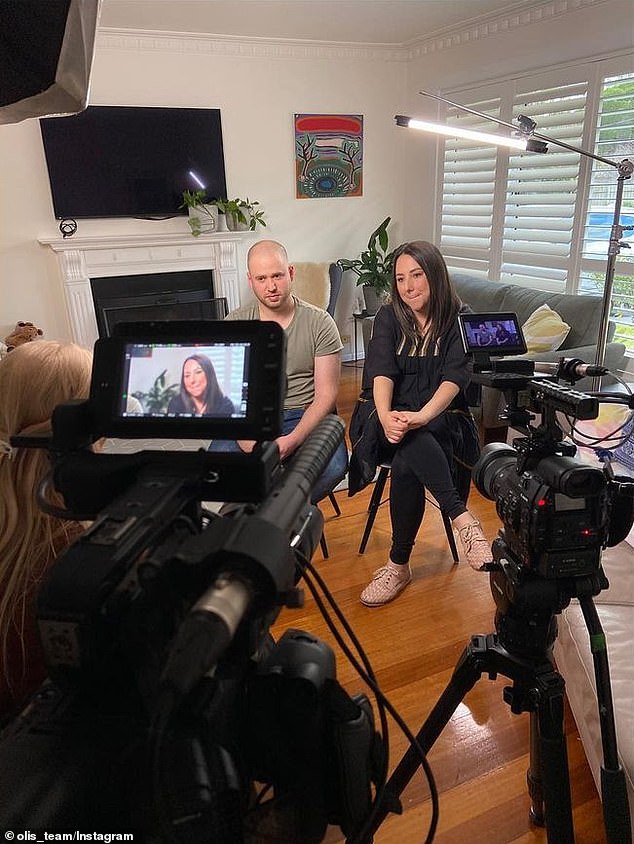
Identify the location of blinds. (451, 160).